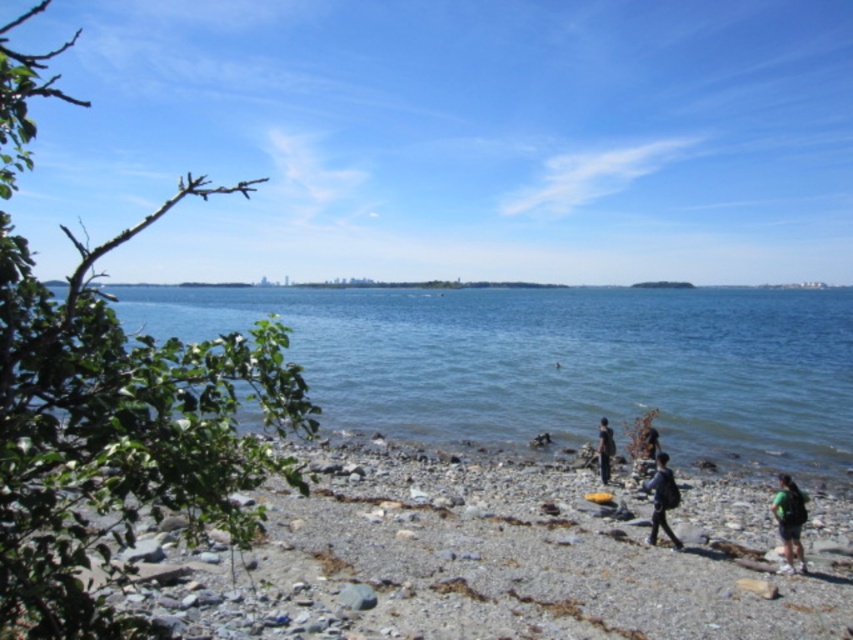
Question: Is smooth pebbles at center thinner than dark gray backpack at lower right?

Choices:
 (A) no
 (B) yes

Answer: (A)

Question: Which of the following is the closest to the observer?

Choices:
 (A) dark gray backpack at lower right
 (B) clear blue water at center

Answer: (A)

Question: Estimate the real-world distances between objects in this image. Which object is closer to the clear blue water at center?

Choices:
 (A) dark gray backpack at lower right
 (B) green fabric backpack at lower right
 (C) dark gray fabric jacket at center

Answer: (B)

Question: Does clear blue water at center have a greater width compared to green fabric backpack at lower right?

Choices:
 (A) yes
 (B) no

Answer: (A)

Question: Can you confirm if smooth pebbles at center is positioned below green fabric backpack at lower right?

Choices:
 (A) yes
 (B) no

Answer: (A)

Question: Estimate the real-world distances between objects in this image. Which object is farther from the green fabric backpack at lower right?

Choices:
 (A) dark gray fabric jacket at center
 (B) smooth pebbles at center
 (C) dark gray backpack at lower right
 (D) clear blue water at center

Answer: (D)